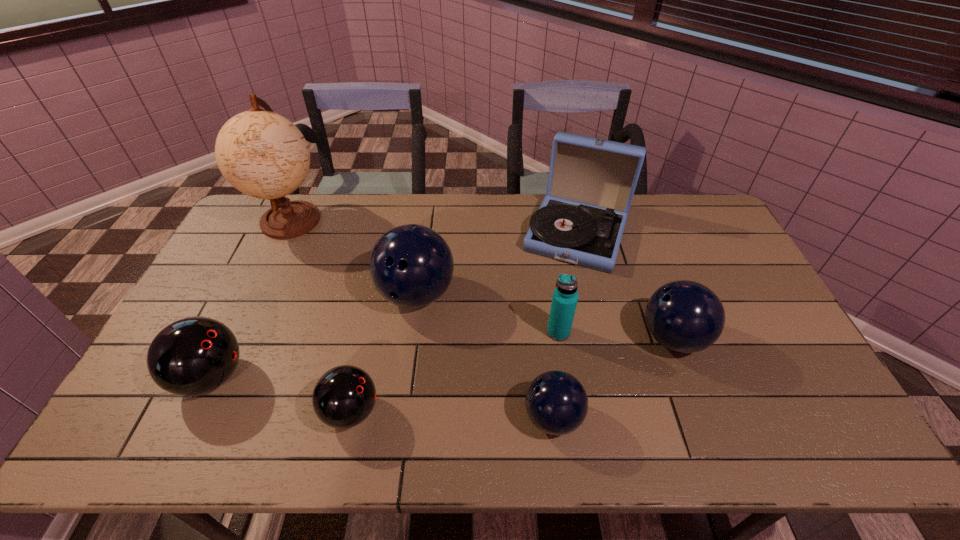
Find the location of `the tallest object`. the tallest object is located at coordinates (262, 154).

Where is `globe`? This screenshot has height=540, width=960. globe is located at coordinates (262, 154).

The width and height of the screenshot is (960, 540). What are the coordinates of `blue phonograph record` in the screenshot? It's located at (591, 183).

Find the location of a particular element. phonograph record is located at coordinates (591, 183).

At what (x,y) coordinates should I click in order to perform the action: click on the tallest bowling ball. Please return your answer as a coordinate pair (x, y). Image resolution: width=960 pixels, height=540 pixels. Looking at the image, I should click on (411, 265).

The width and height of the screenshot is (960, 540). Identify the location of the biggest blue bowling ball. (411, 265).

The width and height of the screenshot is (960, 540). Find the location of `water bottle`. water bottle is located at coordinates (565, 297).

Identify the location of the rightmost blue bowling ball. Image resolution: width=960 pixels, height=540 pixels. (685, 316).

At what (x,y) coordinates should I click in order to perform the action: click on the rightmost bowling ball. Please return your answer as a coordinate pair (x, y). The image size is (960, 540). Looking at the image, I should click on (685, 316).

Find the location of `the leftmost bowling ball`. the leftmost bowling ball is located at coordinates (192, 356).